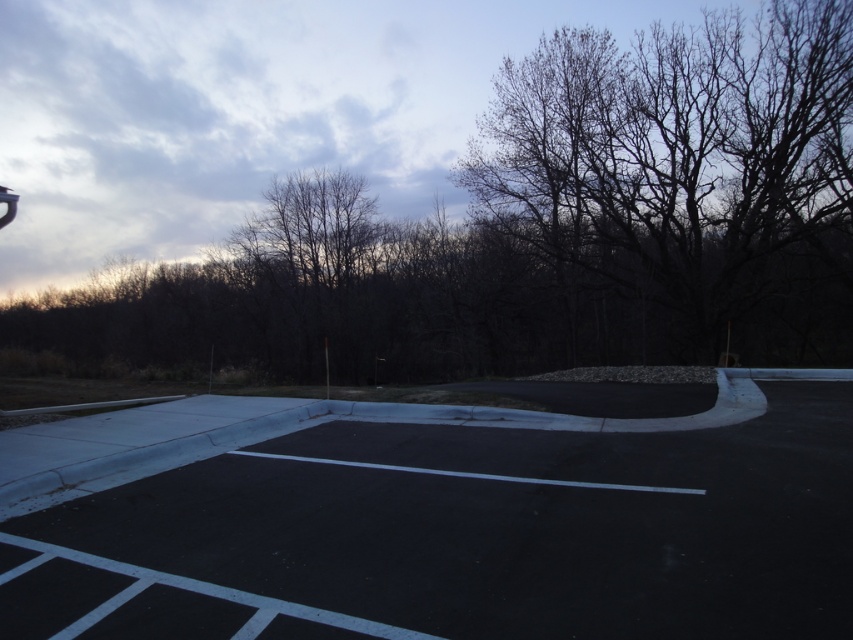
You are a bird flying over the black asphalt parking lot at center and the bare branches at upper right. Which object would you see first as you approach the scene from above?

The bare branches at upper right would be seen first because they are taller than the black asphalt parking lot at center.

You are a surveyor trying to determine the relative sizes of objects in the image. Given that you can see both the black asphalt parking lot at center and the bare branches at upper right, which object occupies a larger area in the image?

The bare branches at upper right occupy a larger area in the image since the black asphalt parking lot at center has a smaller size compared to them.

You are a delivery driver who needs to park your vehicle in the black asphalt parking lot at center. However, you notice bare branches at upper right nearby. Which direction should you drive to reach the parking lot without passing through the area with the branches?

The black asphalt parking lot at center is positioned on the left side of the bare branches at upper right, so you should drive to the left to reach the parking lot without passing through the area with the branches.